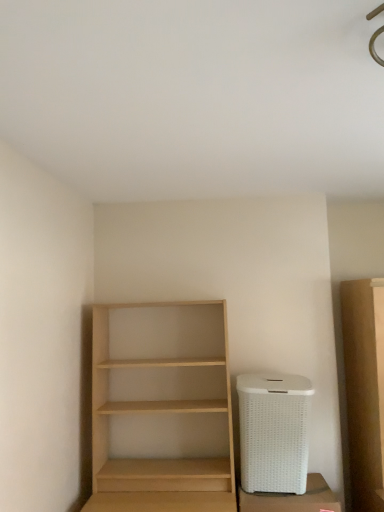
Question: Does white wicker laundry basket at lower right have a smaller size compared to light wood shelf at center?

Choices:
 (A) no
 (B) yes

Answer: (B)

Question: Is white wicker laundry basket at lower right wider than light wood shelf at center?

Choices:
 (A) yes
 (B) no

Answer: (B)

Question: From the image's perspective, is white wicker laundry basket at lower right beneath light wood shelf at center?

Choices:
 (A) yes
 (B) no

Answer: (A)

Question: Is white wicker laundry basket at lower right to the left of light wood shelf at center from the viewer's perspective?

Choices:
 (A) yes
 (B) no

Answer: (B)

Question: Is white wicker laundry basket at lower right positioned with its back to light wood shelf at center?

Choices:
 (A) no
 (B) yes

Answer: (A)

Question: From the image's perspective, does white wicker laundry basket at lower right appear higher than light wood shelf at center?

Choices:
 (A) no
 (B) yes

Answer: (A)

Question: Would you say white wicker laundry basket at lower right is part of light wood shelf at center's contents?

Choices:
 (A) no
 (B) yes

Answer: (A)

Question: Is light wood shelf at center in front of white wicker laundry basket at lower right?

Choices:
 (A) no
 (B) yes

Answer: (B)

Question: Is light wood shelf at center at the left side of white wicker laundry basket at lower right?

Choices:
 (A) yes
 (B) no

Answer: (A)

Question: Is light wood shelf at center at the right side of white wicker laundry basket at lower right?

Choices:
 (A) yes
 (B) no

Answer: (B)

Question: Is light wood shelf at center shorter than white wicker laundry basket at lower right?

Choices:
 (A) no
 (B) yes

Answer: (A)

Question: Is light wood shelf at center oriented away from white wicker laundry basket at lower right?

Choices:
 (A) yes
 (B) no

Answer: (B)

Question: Is white wicker trash can at lower right aimed at light wood shelf at center?

Choices:
 (A) yes
 (B) no

Answer: (B)